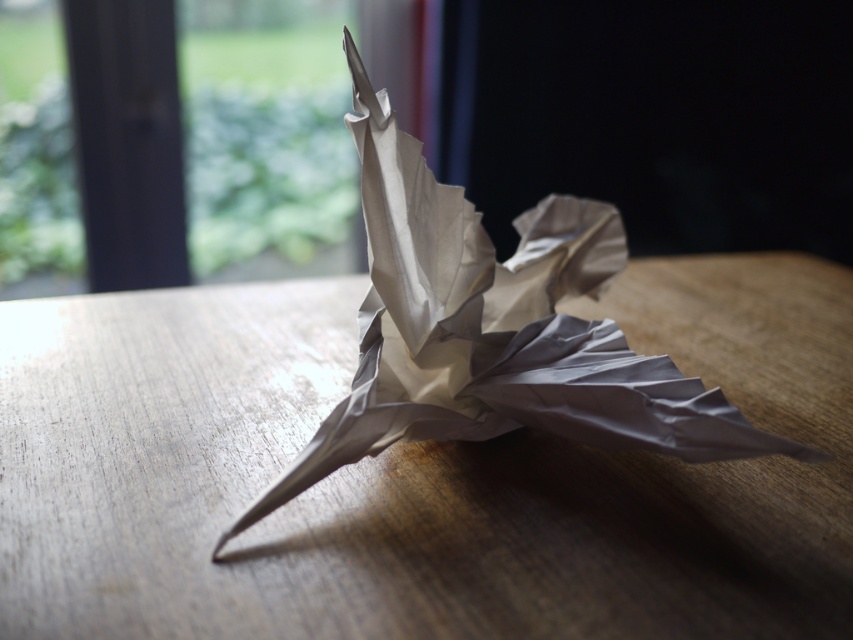
Between wooden table at center and matte paper bird at center, which one is positioned higher?

matte paper bird at center

Which is behind, point (706, 305) or point (502, 397)?

Positioned behind is point (706, 305).

The height and width of the screenshot is (640, 853). In order to click on wooden table at center in this screenshot , I will do `click(415, 476)`.